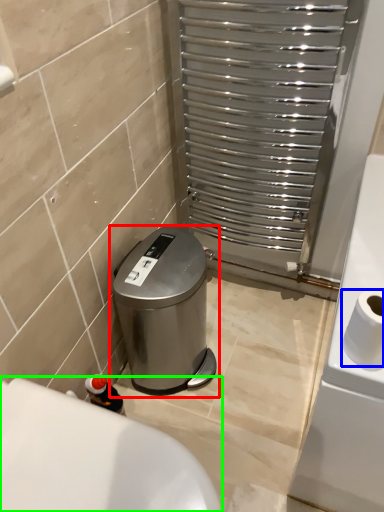
Question: Considering the real-world distances, which object is farthest from waste container (highlighted by a red box)? toilet paper (highlighted by a blue box) or bath (highlighted by a green box)?

Choices:
 (A) toilet paper
 (B) bath

Answer: (A)